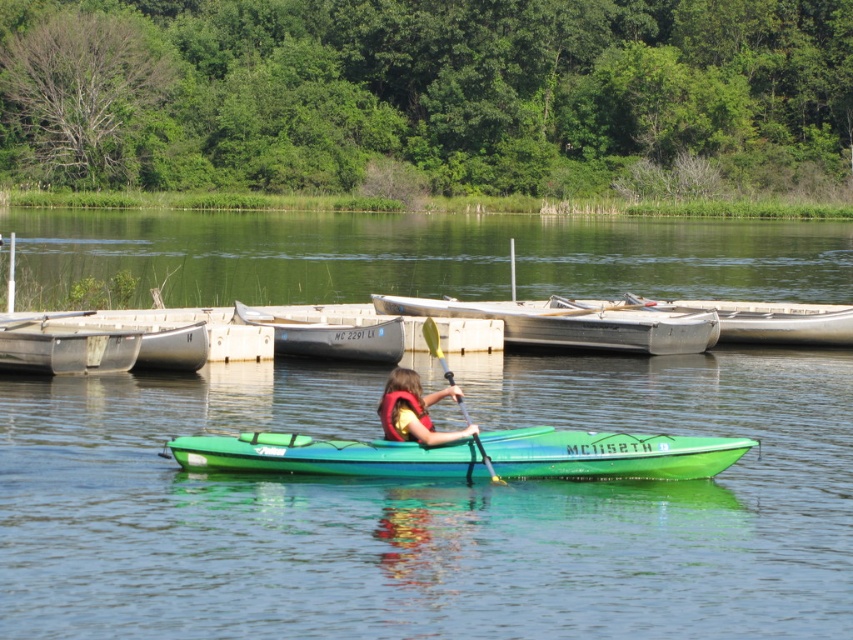
You are a drone operator trying to capture a photo of the green plastic kayak at center. The drone is currently at coordinates 0.5, 0.5. What direction should you move the drone to get closer to the kayak?

The green plastic kayak at center is located at coordinates (469, 454). Since the drone is at (426, 320), you should move the drone to the northeast to get closer to the kayak.

You are a drone operator trying to capture a photo of the green plastic kayak at center from above. The drone must hover exactly above the kayak to get the perfect shot. What are the coordinates where you should position the drone?

The green plastic kayak at center is located at coordinates point (469, 454), so the drone should hover above point (469, 454) to capture the photo.

You are planning to store the green plastic kayak at center and the smooth white paddle at left in a storage room. The storage room has a maximum weight capacity of 100 kg. Can you determine if both items can be safely stored together based on their sizes?

The green plastic kayak at center has a larger size compared to the smooth white paddle at left. However, size does not directly indicate weight. Without specific weight information, it is impossible to determine if their combined weight exceeds the storage room capacity of 100 kg.